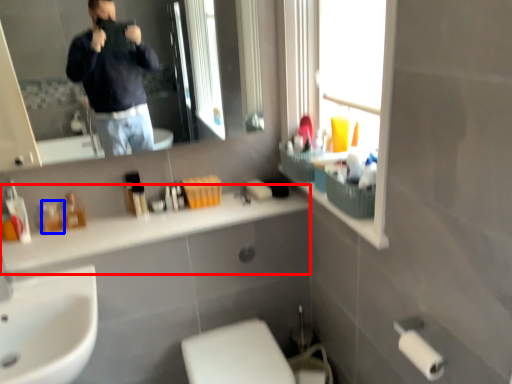
Question: Which object is further to the camera taking this photo, counter top (highlighted by a red box) or toiletry (highlighted by a blue box)?

Choices:
 (A) counter top
 (B) toiletry

Answer: (B)